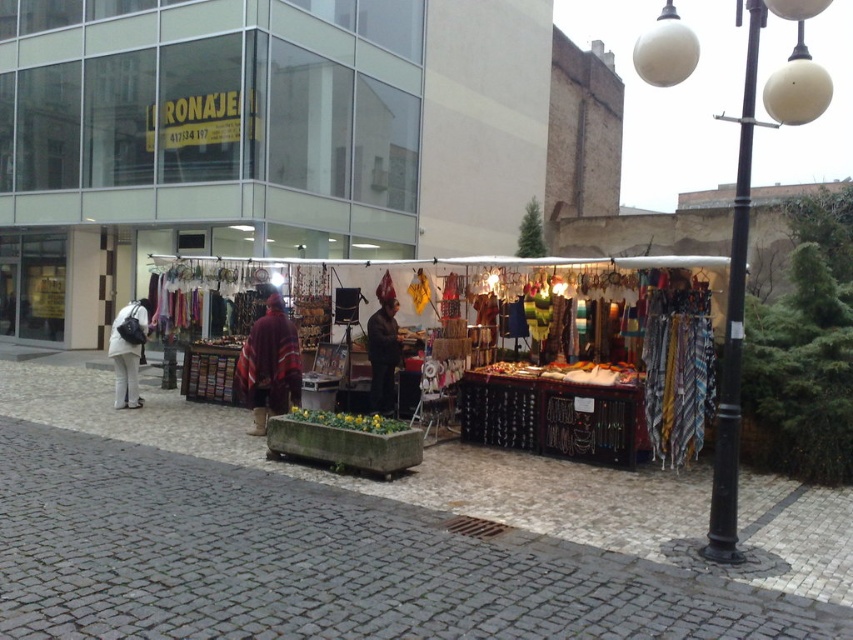
You are a customer at the market stall and want to know which item is wider between the textured fabric stall at center and the white matte coat at left. Which one is wider?

The textured fabric stall at center is wider than the white matte coat at left.